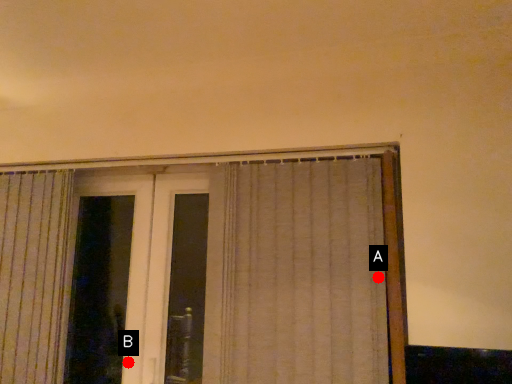
Question: Two points are circled on the image, labeled by A and B beside each circle. Which of the following is the closest to the observer?

Choices:
 (A) A is closer
 (B) B is closer

Answer: (A)